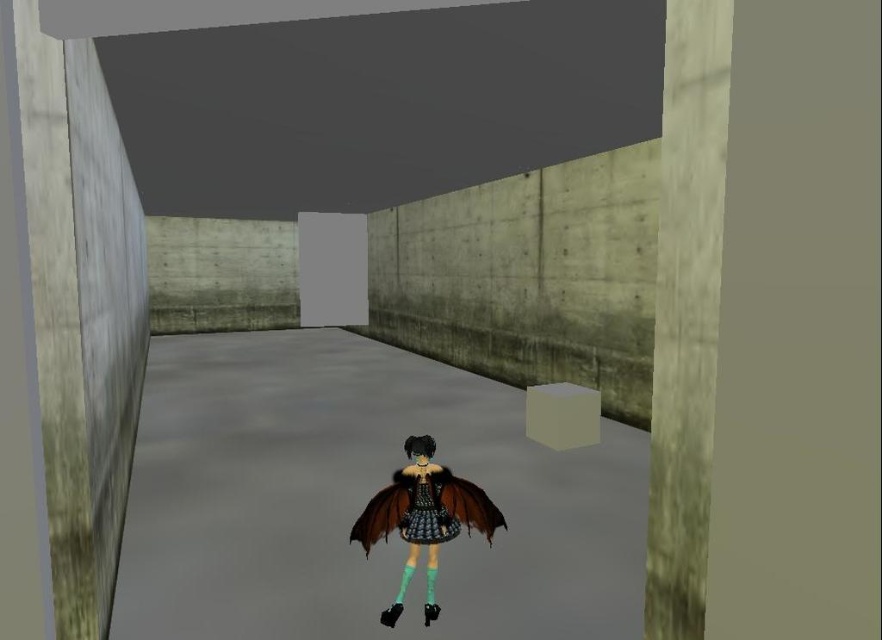
You are a character in the room and want to hide behind an object to avoid being seen from the left side of the room. Can you hide behind the concrete wall at right and the shiny black lace dress at center? Explain why or why not.

The concrete wall at right is above the shiny black lace dress at center, so the dress is shorter in height than the wall. Since the wall is taller and positioned above the dress, you can hide behind the concrete wall at right but not the shiny black lace dress at center because it is shorter and may not provide sufficient coverage from the left side of the room.

You are a character in the game who needs to pass through a narrow doorway. The doorway is just wide enough to fit the narrower of the two objects in the scene. Which object between the smooth concrete pillar at left and the concrete wall at right can you use as a reference to determine if you can fit through the doorway?

The smooth concrete pillar at left is wider than the concrete wall at right, so you should use the concrete wall at right as a reference since it is narrower and the doorway is just wide enough for the narrower object.

You are navigating a character in a video game. Your current position is at point [60,141] and you want to reach point [685,376]. Is the destination point in front of or behind you?

The destination point [685,376] is in front of your current position at point [60,141] because the description states that point [60,141] is behind point [685,376].